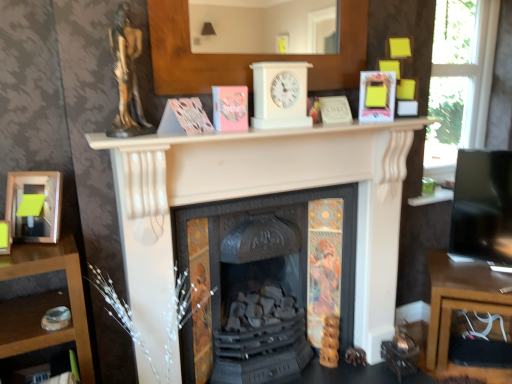
Identify the location of vacant space situated above white plastic clock at center (from a real-world perspective). The image size is (512, 384). pos(270,60).